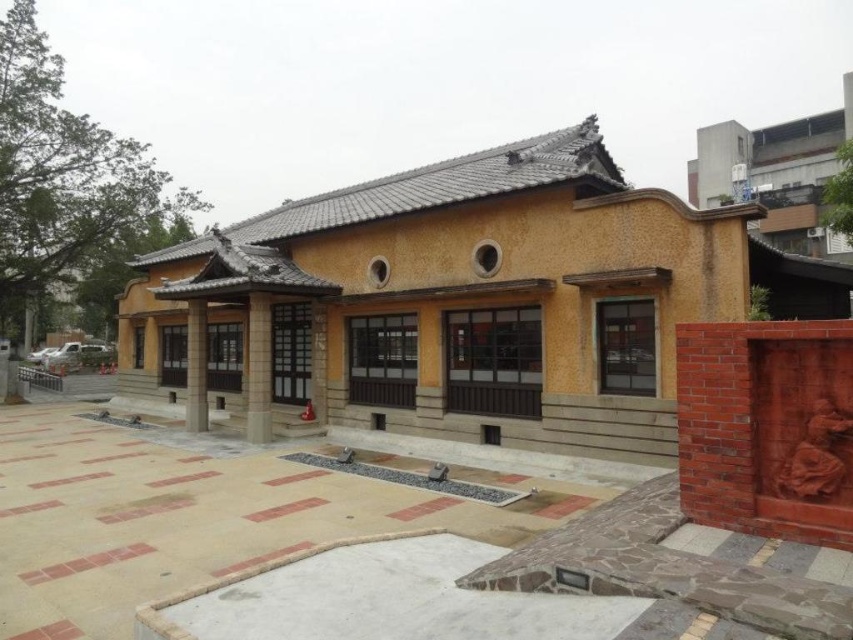
You are standing in front of the traditional East Asian building and notice two columns in the center. Which one is taller between the smooth stone column at center and the smooth concrete pillar at center?

The smooth stone column at center is taller than the smooth concrete pillar at center.

You are a delivery person with a cart that is 2.5 meters wide. You need to pass between the smooth stone column at center and the smooth concrete pillar at center. Can your cart fit through the space between them?

The distance between the smooth stone column at center and the smooth concrete pillar at center is 2.63 meters. Since your cart is 2.5 meters wide, it can fit through the space as there is enough clearance.

You are standing in front of the traditional East Asian building. You notice two columns supporting the porch roof. One is a smooth stone column at center and the other is a smooth concrete pillar at center. Which one is located higher up?

The smooth stone column at center is positioned over the smooth concrete pillar at center, so it is located higher up.